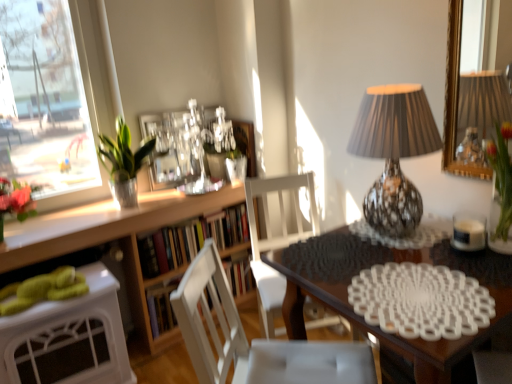
Where is `free area in between shiny metallic lamp at upper right and white glass candle at right`? free area in between shiny metallic lamp at upper right and white glass candle at right is located at coordinates [440, 247].